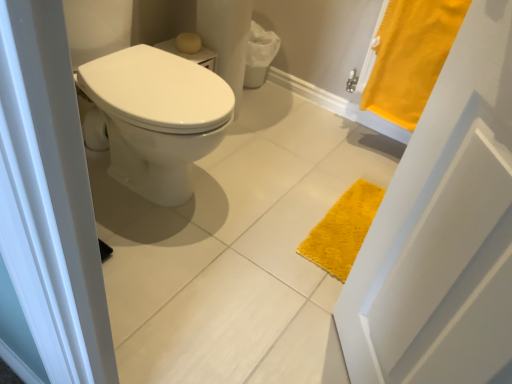
Question: Based on their positions, is matte yellow soap at upper center located to the left or right of yellow fabric bath towel at upper right?

Choices:
 (A) left
 (B) right

Answer: (A)

Question: From the image's perspective, relative to yellow fabric bath towel at upper right, is matte yellow soap at upper center above or below?

Choices:
 (A) below
 (B) above

Answer: (B)

Question: Is point (181, 44) closer or farther from the camera than point (377, 56)?

Choices:
 (A) closer
 (B) farther

Answer: (A)

Question: Would you say yellow fabric bath towel at upper right is inside or outside matte yellow soap at upper center?

Choices:
 (A) inside
 (B) outside

Answer: (B)

Question: Considering the positions of yellow fabric bath towel at upper right and matte yellow soap at upper center in the image, is yellow fabric bath towel at upper right taller or shorter than matte yellow soap at upper center?

Choices:
 (A) short
 (B) tall

Answer: (B)

Question: From a real-world perspective, is yellow fabric bath towel at upper right physically located above or below matte yellow soap at upper center?

Choices:
 (A) above
 (B) below

Answer: (A)

Question: Considering their positions, is yellow fabric bath towel at upper right located in front of or behind matte yellow soap at upper center?

Choices:
 (A) behind
 (B) front

Answer: (B)